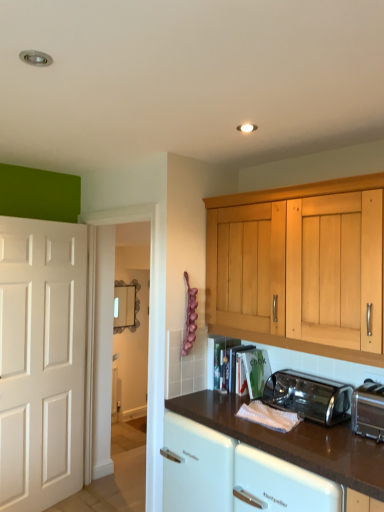
Locate an element on the screen. The width and height of the screenshot is (384, 512). free space above brown glossy countertop at lower center (from a real-world perspective) is located at coordinates (284, 420).